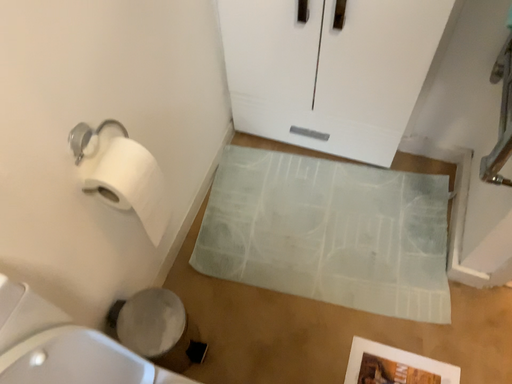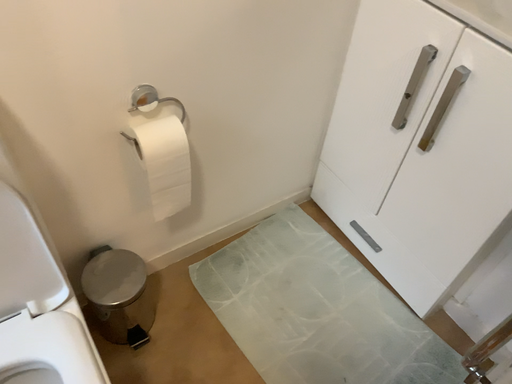
Question: How did the camera likely rotate when shooting the video?

Choices:
 (A) rotated left
 (B) rotated right

Answer: (A)